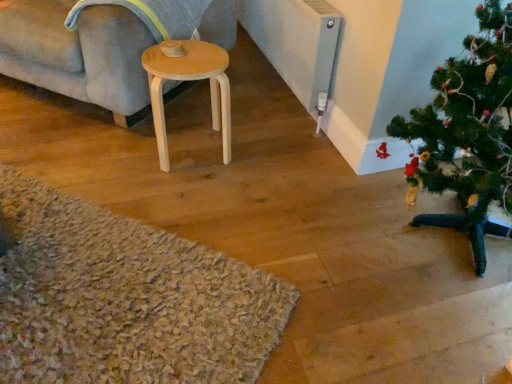
Question: Should I look upward or downward to see light wood stool at center?

Choices:
 (A) down
 (B) up

Answer: (B)

Question: Is light gray fabric couch at upper left positioned far away from green matte christmas tree at lower right?

Choices:
 (A) yes
 (B) no

Answer: (A)

Question: Considering the relative positions of light gray fabric couch at upper left and green matte christmas tree at lower right in the image provided, is light gray fabric couch at upper left to the left of green matte christmas tree at lower right from the viewer's perspective?

Choices:
 (A) no
 (B) yes

Answer: (B)

Question: Can you confirm if light gray fabric couch at upper left is smaller than green matte christmas tree at lower right?

Choices:
 (A) no
 (B) yes

Answer: (A)

Question: Can you confirm if light gray fabric couch at upper left is bigger than green matte christmas tree at lower right?

Choices:
 (A) no
 (B) yes

Answer: (B)

Question: Is green matte christmas tree at lower right a part of light gray fabric couch at upper left?

Choices:
 (A) no
 (B) yes

Answer: (A)

Question: Can you confirm if light gray fabric couch at upper left is taller than green matte christmas tree at lower right?

Choices:
 (A) no
 (B) yes

Answer: (A)

Question: From a real-world perspective, is textured gray radiator at center right physically above green matte christmas tree at lower right?

Choices:
 (A) yes
 (B) no

Answer: (B)

Question: Is textured gray radiator at center right far away from green matte christmas tree at lower right?

Choices:
 (A) no
 (B) yes

Answer: (A)

Question: Does textured gray radiator at center right come behind green matte christmas tree at lower right?

Choices:
 (A) yes
 (B) no

Answer: (A)

Question: Considering the relative sizes of textured gray radiator at center right and green matte christmas tree at lower right in the image provided, is textured gray radiator at center right taller than green matte christmas tree at lower right?

Choices:
 (A) no
 (B) yes

Answer: (A)

Question: From the image's perspective, is textured gray radiator at center right over green matte christmas tree at lower right?

Choices:
 (A) no
 (B) yes

Answer: (B)

Question: Is textured gray radiator at center right positioned with its back to green matte christmas tree at lower right?

Choices:
 (A) no
 (B) yes

Answer: (A)

Question: Is textured gray radiator at center right further to the viewer compared to light wood stool at center?

Choices:
 (A) yes
 (B) no

Answer: (A)